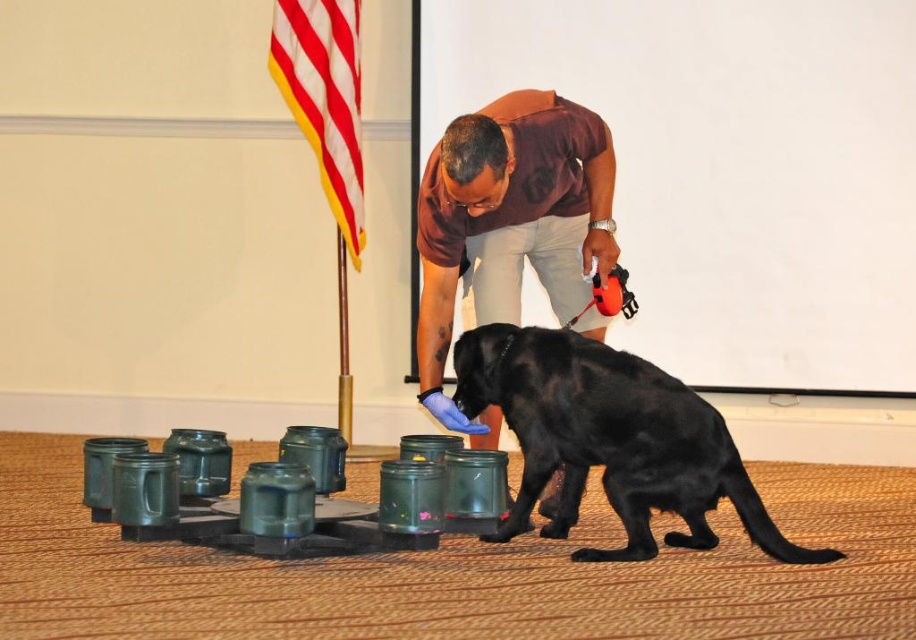
You are a photographer positioned in the room where the black matte dog at center and the red and white striped flag at upper left are present. You want to capture a photo that emphasizes the size difference between these two objects. Which object should you zoom in on to make the size difference more apparent?

To emphasize the size difference between the black matte dog at center and the red and white striped flag at upper left, you should zoom in on the black matte dog at center since it is larger in size than the flag.

You are a photographer positioned at the entrance of the room. You need to capture a photo of the matte brown shirt at center and the red and white striped flag at upper left. Based on their positions, which object is closer to your right side?

The matte brown shirt at center is to the right of the red and white striped flag at upper left, so the matte brown shirt at center is closer to your right side.

You are a photographer standing at the camera position. You want to take a closeup shot of the matte brown shirt at center without moving the camera. Is it possible to do so with a standard zoom lens that has a maximum zoom of 200mm?

The matte brown shirt at center is 3.29 meters away from camera. With a standard zoom lens of 200mm, it is possible to take a closeup shot without moving the camera, as the distance is within the effective range of the lens.